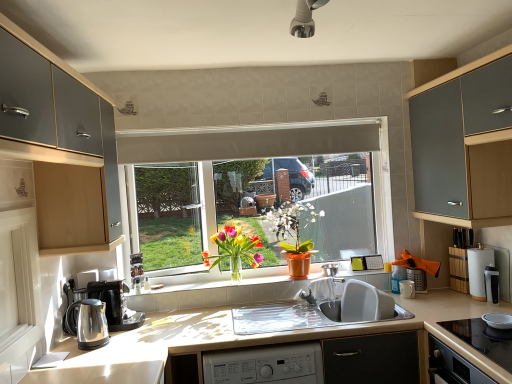
The height and width of the screenshot is (384, 512). In order to click on free space above black ceramic bowl at lower right, marked as the 2th appliance in a right-to-left arrangement (from a real-world perspective) in this screenshot , I will do `click(499, 321)`.